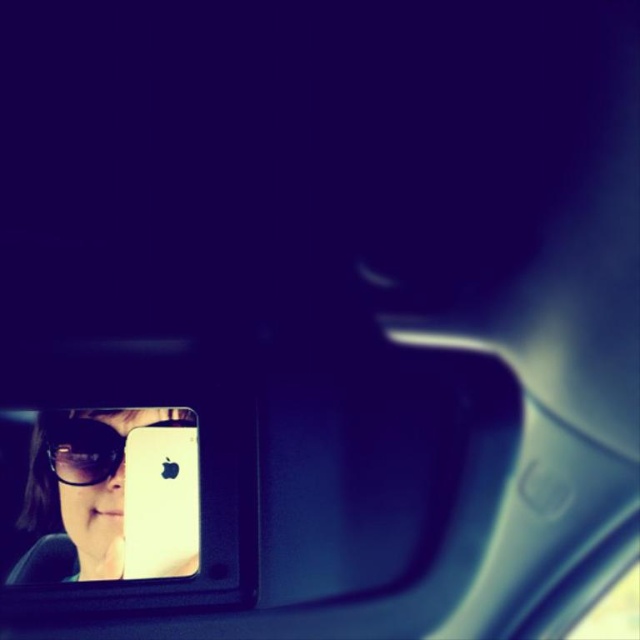
Which of these two, matte black sunglasses at lower left or matte black goggles at lower left, stands shorter?

With less height is matte black goggles at lower left.

Which is above, matte black sunglasses at lower left or matte black goggles at lower left?

matte black goggles at lower left is higher up.

Where is `matte black sunglasses at lower left`? The width and height of the screenshot is (640, 640). matte black sunglasses at lower left is located at coordinates (86, 481).

Does matte black sunglasses at lower left have a greater width compared to white matte smartphone at center?

Indeed, matte black sunglasses at lower left has a greater width compared to white matte smartphone at center.

Which is more to the left, matte black sunglasses at lower left or white matte smartphone at center?

From the viewer's perspective, matte black sunglasses at lower left appears more on the left side.

What do you see at coordinates (86, 481) in the screenshot?
I see `matte black sunglasses at lower left` at bounding box center [86, 481].

You are a GUI agent. You are given a task and a screenshot of the screen. Output one action in this format:
    pyautogui.click(x=<x>, y=<y>)
    Task: Click on the matte black sunglasses at lower left
    
    Given the screenshot: What is the action you would take?
    pyautogui.click(x=86, y=481)

Who is more distant from viewer, (132,528) or (58,440)?

Point (132,528)

Between white matte smartphone at center and matte black goggles at lower left, which one has less height?

Standing shorter between the two is matte black goggles at lower left.

Measure the distance between point (145, 525) and camera.

A distance of 90.45 centimeters exists between point (145, 525) and camera.

Identify the location of white matte smartphone at center. This screenshot has height=640, width=640. (161, 502).